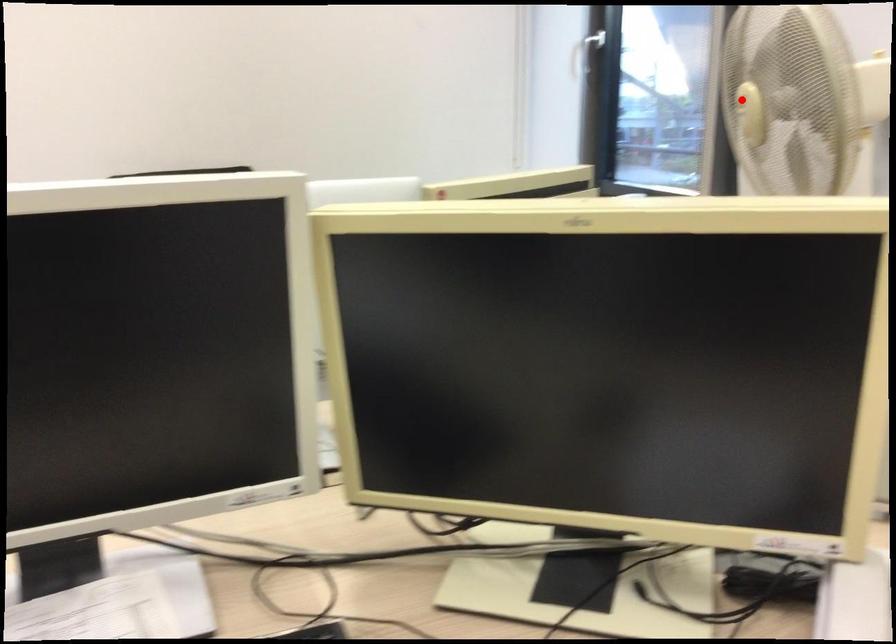
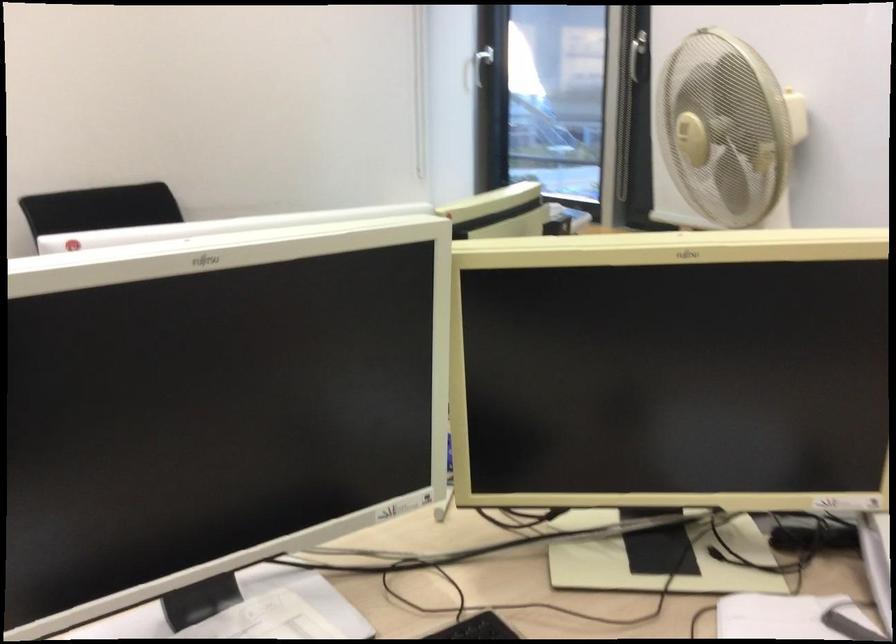
Question: I am providing you with two images of the same scene from different viewpoints. Image1 has a red point marked. In image2, the corresponding 3D location appears at what relative position? Reply with the corresponding letter.

Choices:
 (A) Closer
 (B) Farther

Answer: (B)